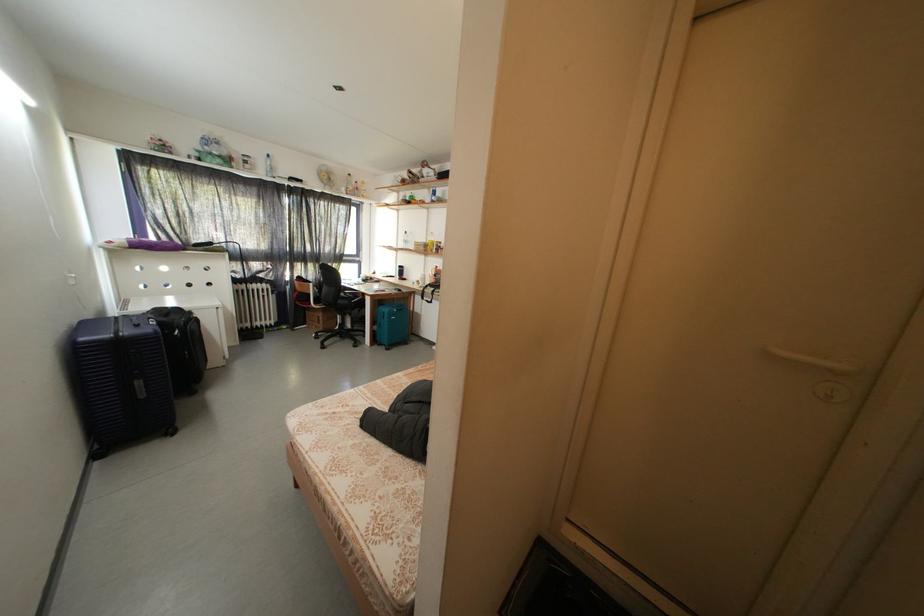
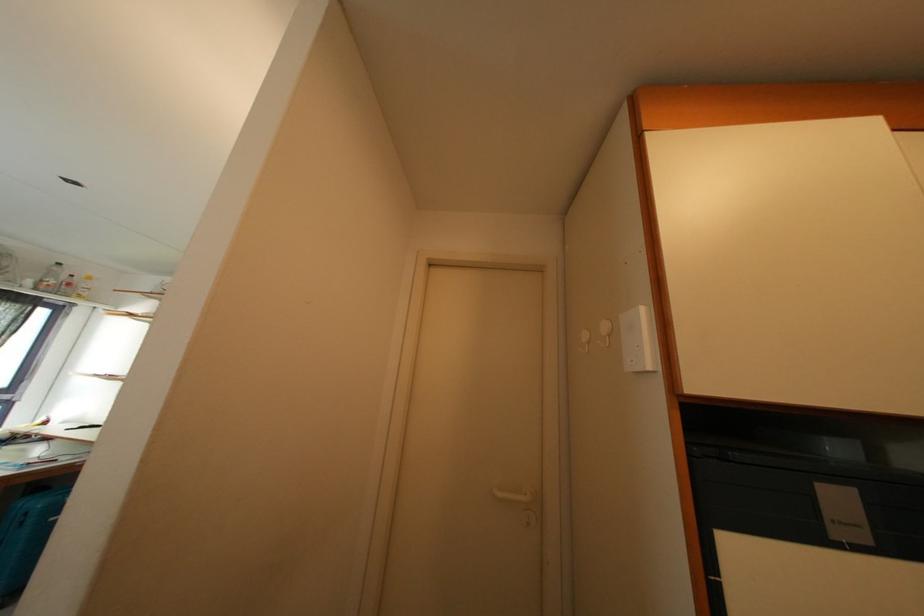
The point at (351,195) is marked in the first image. Where is the corresponding point in the second image?

(38, 286)